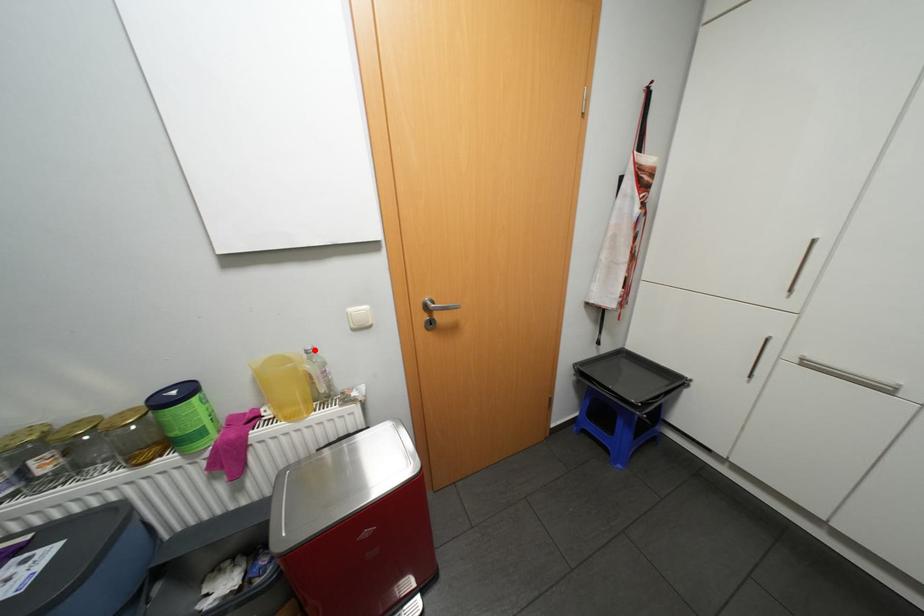
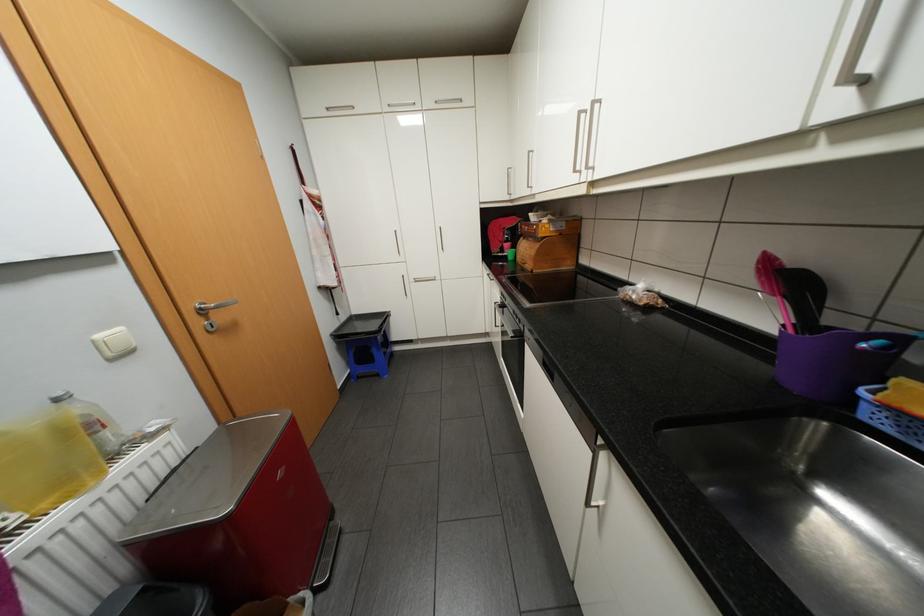
In the second image, find the point that corresponds to the highlighted location in the first image.

(65, 399)